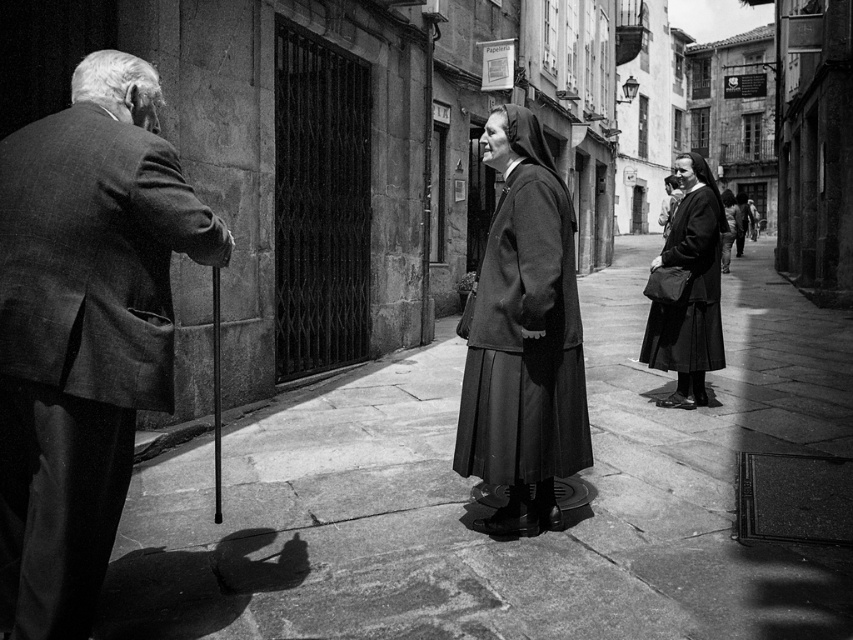
Question: Is smooth stone pavement at center bigger than textured wool suit at left?

Choices:
 (A) yes
 (B) no

Answer: (A)

Question: Estimate the real-world distances between objects in this image. Which object is farther from the matte black dress at center?

Choices:
 (A) textured wool suit at left
 (B) smooth stone pavement at center

Answer: (A)

Question: Which point is farther from the camera taking this photo?

Choices:
 (A) (381, 451)
 (B) (701, 301)
 (C) (10, 468)

Answer: (B)

Question: Which of the following is the closest to the observer?

Choices:
 (A) smooth stone pavement at center
 (B) matte black dress at center
 (C) textured wool suit at left

Answer: (C)

Question: Does smooth stone pavement at center lie behind textured wool suit at left?

Choices:
 (A) yes
 (B) no

Answer: (A)

Question: Does smooth stone pavement at center have a greater width compared to matte black dress at center?

Choices:
 (A) yes
 (B) no

Answer: (A)